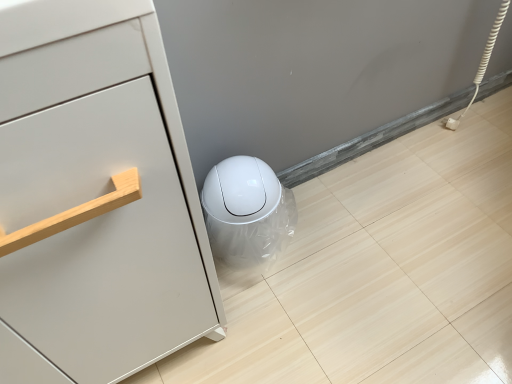
In order to click on vacant space in front of white glossy trash can at lower center in this screenshot , I will do `click(266, 298)`.